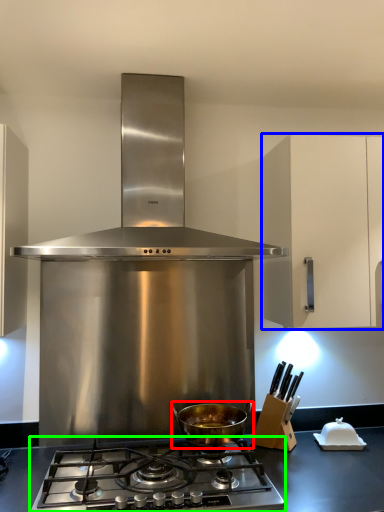
Question: Which object is positioned closest to kitchen appliance (highlighted by a red box)? Select from cabinetry (highlighted by a blue box) and gas stove (highlighted by a green box).

Choices:
 (A) cabinetry
 (B) gas stove

Answer: (B)